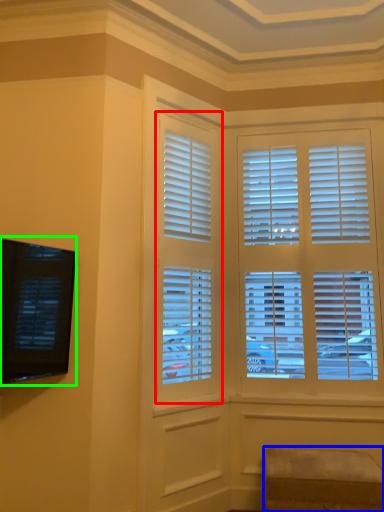
Question: Which is farther away from window (highlighted by a red box)? furniture (highlighted by a blue box) or window screen (highlighted by a green box)?

Choices:
 (A) furniture
 (B) window screen

Answer: (A)